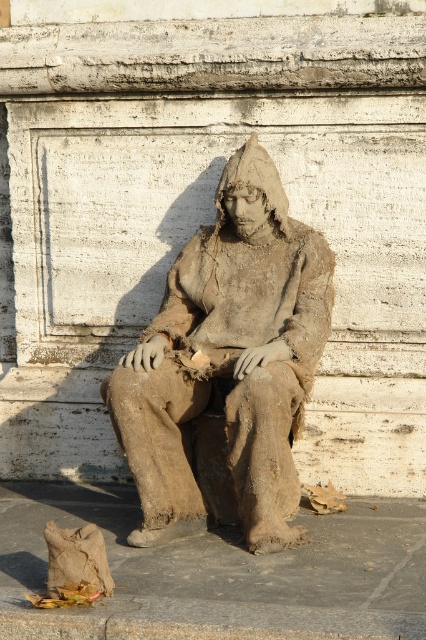
Who is lower down, brown textured statue at center or brown fabric bag at lower left?

Positioned lower is brown fabric bag at lower left.

Which is behind, point (190, 385) or point (383, 598)?

The point (190, 385) is behind.

Is point (276, 465) less distant than point (327, 570)?

No, it is behind (327, 570).

Where is `brown textured statue at center`? This screenshot has height=640, width=426. brown textured statue at center is located at coordinates (227, 368).